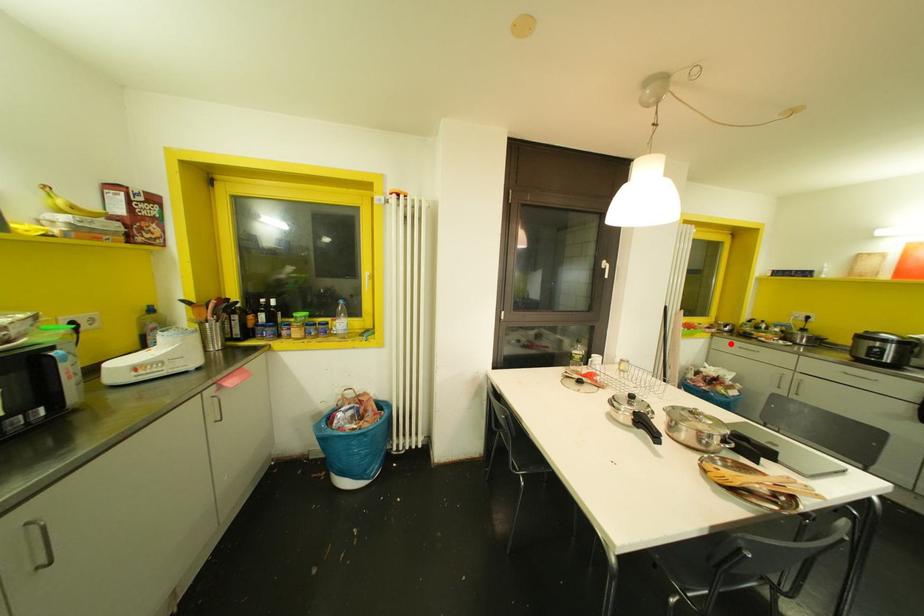
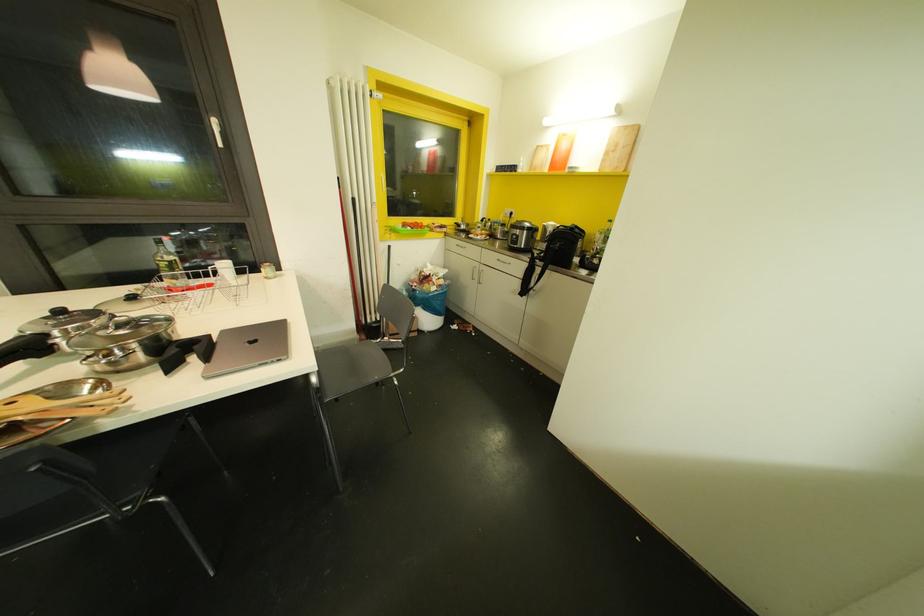
Locate, in the second image, the point that corresponds to the highlighted location in the first image.

(453, 243)